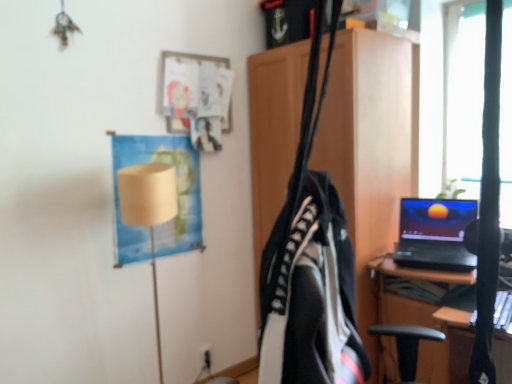
Image resolution: width=512 pixels, height=384 pixels. Describe the element at coordinates (311, 295) in the screenshot. I see `black fabric backpack at center` at that location.

Consider the image. Measure the distance between beige paper lampshade at upper left and camera.

beige paper lampshade at upper left and camera are 2.17 meters apart from each other.

Describe the element at coordinates (368, 149) in the screenshot. I see `wooden cabinet at center` at that location.

Where is `beige fabric lampshade at left`? beige fabric lampshade at left is located at coordinates 148,211.

Is black plastic electric outlet at lower center not within beige paper lampshade at upper left?

Indeed, black plastic electric outlet at lower center is completely outside beige paper lampshade at upper left.

Where is `electric outlet below the beige paper lampshade at upper left (from the image's perspective)`? electric outlet below the beige paper lampshade at upper left (from the image's perspective) is located at coordinates (206, 356).

Does black plastic electric outlet at lower center have a lesser width compared to beige paper lampshade at upper left?

Correct, the width of black plastic electric outlet at lower center is less than that of beige paper lampshade at upper left.

From a real-world perspective, is black plastic electric outlet at lower center over beige paper lampshade at upper left?

Actually, black plastic electric outlet at lower center is physically below beige paper lampshade at upper left in the real world.

From the image's perspective, which one is positioned lower, black plastic electric outlet at lower center or black fabric bag at center?

black plastic electric outlet at lower center.

Measure the distance from black plastic electric outlet at lower center to black fabric bag at center.

A distance of 1.77 meters exists between black plastic electric outlet at lower center and black fabric bag at center.

Is black plastic electric outlet at lower center positioned far away from black fabric bag at center?

Absolutely, black plastic electric outlet at lower center is distant from black fabric bag at center.

What's the angular difference between black plastic electric outlet at lower center and black fabric bag at center's facing directions?

87.1 degrees.

Considering the positions of objects beige paper lampshade at upper left and black fabric backpack at center in the image provided, who is more to the right, beige paper lampshade at upper left or black fabric backpack at center?

black fabric backpack at center.

How different are the orientations of beige paper lampshade at upper left and black fabric backpack at center in degrees?

The angular difference between beige paper lampshade at upper left and black fabric backpack at center is 26.5 degrees.

Which is closer, (x=163, y=157) or (x=292, y=354)?

Clearly, point (x=163, y=157) is more distant from the camera than point (x=292, y=354).

Considering the sizes of beige paper lampshade at upper left and beige fabric lampshade at left in the image, is beige paper lampshade at upper left taller or shorter than beige fabric lampshade at left?

Considering their sizes, beige paper lampshade at upper left has less height than beige fabric lampshade at left.

From the image's perspective, which is below, beige paper lampshade at upper left or beige fabric lampshade at left?

beige fabric lampshade at left appears lower in the image.

Is beige paper lampshade at upper left bigger than beige fabric lampshade at left?

Actually, beige paper lampshade at upper left might be smaller than beige fabric lampshade at left.

Is beige fabric lampshade at left at the back of beige paper lampshade at upper left?

No, beige paper lampshade at upper left is not facing away from beige fabric lampshade at left.

Considering the positions of objects black fabric backpack at center and wooden cabinet at center in the image provided, who is in front, black fabric backpack at center or wooden cabinet at center?

black fabric backpack at center is closer to the camera.

Which point is more distant from viewer, (269, 311) or (375, 238)?

Positioned behind is point (375, 238).

Looking at this image, is black fabric backpack at center inside the boundaries of wooden cabinet at center, or outside?

The correct answer is: outside.

Which of these two, black plastic electric outlet at lower center or black fabric backpack at center, is smaller?

Smaller between the two is black plastic electric outlet at lower center.

How different are the orientations of black plastic electric outlet at lower center and black fabric backpack at center in degrees?

The angle between the facing direction of black plastic electric outlet at lower center and the facing direction of black fabric backpack at center is 25.5 degrees.

Is black plastic electric outlet at lower center at the left side of black fabric backpack at center?

Indeed, black plastic electric outlet at lower center is positioned on the left side of black fabric backpack at center.

Is black plastic electric outlet at lower center not within black fabric backpack at center?

Absolutely, black plastic electric outlet at lower center is external to black fabric backpack at center.

Consider the image. Between beige fabric lampshade at left and beige paper lampshade at upper left, which one is positioned in front?

Positioned in front is beige fabric lampshade at left.

From the image's perspective, relative to beige paper lampshade at upper left, is beige fabric lampshade at left above or below?

Based on their image positions, beige fabric lampshade at left is located beneath beige paper lampshade at upper left.

Are beige fabric lampshade at left and beige paper lampshade at upper left making contact?

No, beige fabric lampshade at left is not with beige paper lampshade at upper left.

I want to click on poster on the left side of black plastic electric outlet at lower center, so click(177, 196).

Locate an element on the screen. This screenshot has height=384, width=512. clothesline on the right of black plastic electric outlet at lower center is located at coordinates (305, 130).

From the picture: Looking at the image, which one is located further to beige fabric lampshade at left, black plastic electric outlet at lower center or black fabric bag at center?

Among the two, black plastic electric outlet at lower center is located further to beige fabric lampshade at left.

From the image, which object appears to be nearer to black plastic electric outlet at lower center, black fabric bag at center or beige fabric lampshade at left?

The object closer to black plastic electric outlet at lower center is beige fabric lampshade at left.

Which object lies further to the anchor point black fabric bag at center, black fabric backpack at center or wooden cabinet at center?

Based on the image, wooden cabinet at center appears to be further to black fabric bag at center.

Looking at the image, which one is located further to black fabric backpack at center, beige fabric lampshade at left or beige paper lampshade at upper left?

The object further to black fabric backpack at center is beige paper lampshade at upper left.

Looking at the image, which one is located closer to beige fabric lampshade at left, black fabric backpack at center or black fabric bag at center?

black fabric backpack at center.

From the image, which object appears to be nearer to black plastic electric outlet at lower center, beige fabric lampshade at left or black fabric backpack at center?

beige fabric lampshade at left.

When comparing their distances from wooden cabinet at center, does black fabric bag at center or black plastic electric outlet at lower center seem closer?

Based on the image, black fabric bag at center appears to be nearer to wooden cabinet at center.

From the image, which object appears to be nearer to black fabric bag at center, wooden cabinet at center or beige paper lampshade at upper left?

wooden cabinet at center is positioned closer to the anchor black fabric bag at center.

Where is `table lamp positioned between black fabric backpack at center and black plastic electric outlet at lower center from near to far`? The image size is (512, 384). table lamp positioned between black fabric backpack at center and black plastic electric outlet at lower center from near to far is located at coordinates (148, 211).

Locate an element on the screen. table lamp between black fabric bag at center and black plastic electric outlet at lower center in the front-back direction is located at coordinates (148, 211).

Locate an element on the screen. This screenshot has height=384, width=512. clothing located between black fabric bag at center and wooden cabinet at center in the depth direction is located at coordinates (311, 295).

Locate an element on the screen. This screenshot has height=384, width=512. poster positioned between black fabric bag at center and black plastic electric outlet at lower center from near to far is located at coordinates (177, 196).